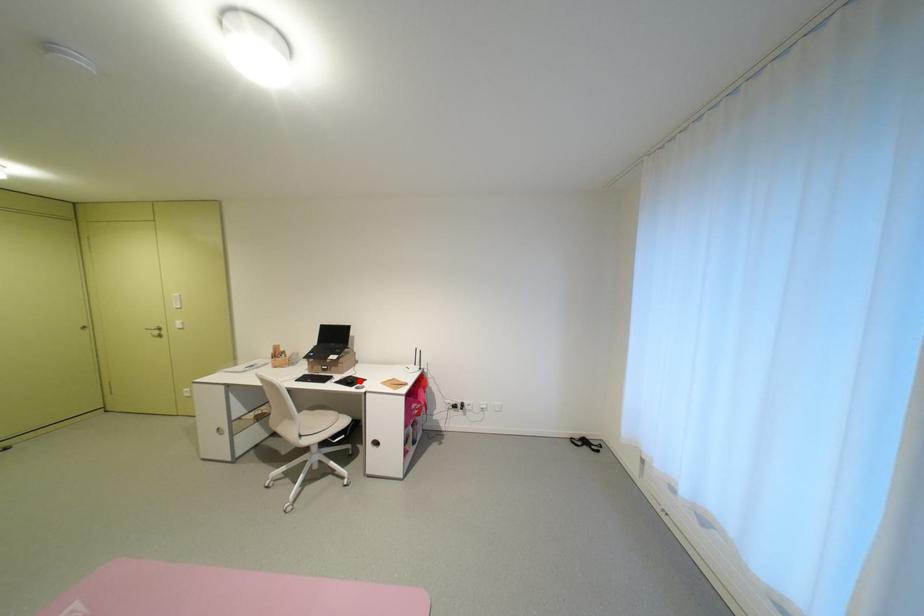
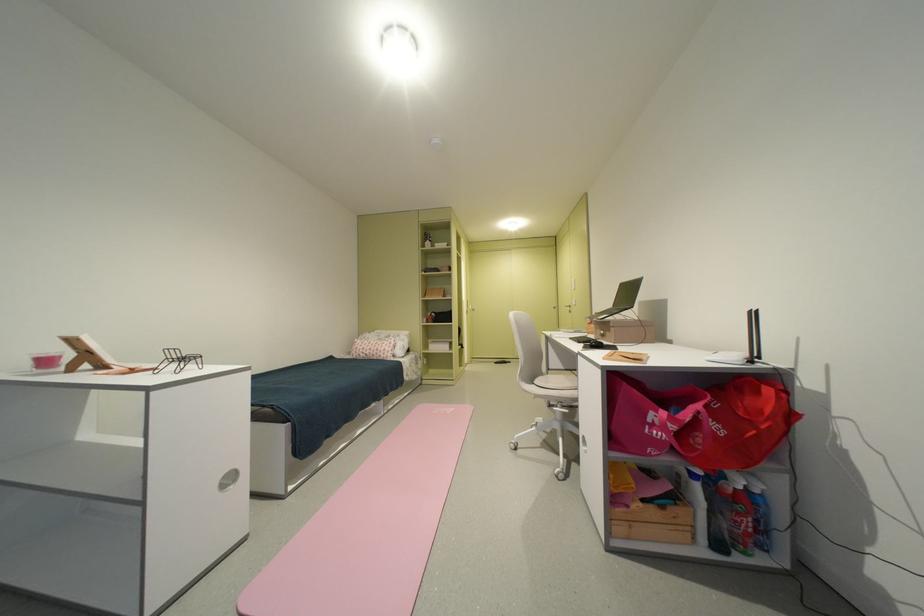
The point at the highlighted location is marked in the first image. Where is the corresponding point in the second image?

(602, 342)